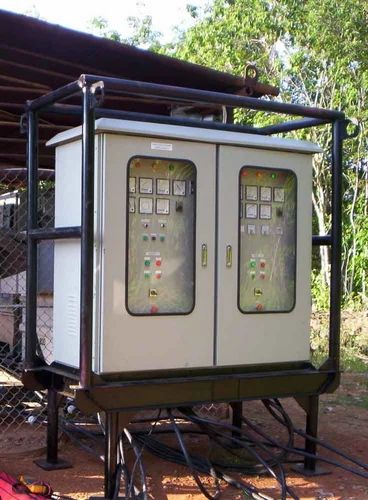
Locate an element on the screen. The width and height of the screenshot is (368, 500). many electrical cords is located at coordinates (286, 411), (276, 417), (262, 433), (254, 440), (226, 434), (177, 441), (155, 439), (164, 452).